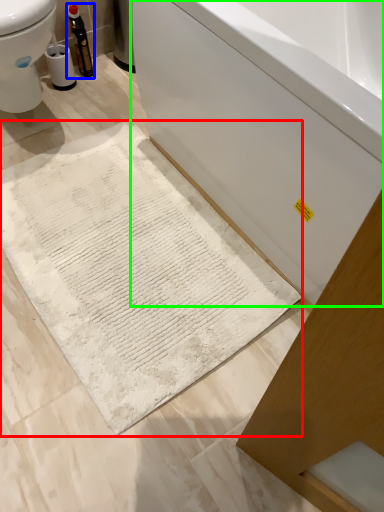
Question: Which object is the farthest from bath mat (highlighted by a red box)? Choose among these: bottle (highlighted by a blue box) or bathtub (highlighted by a green box).

Choices:
 (A) bottle
 (B) bathtub

Answer: (A)